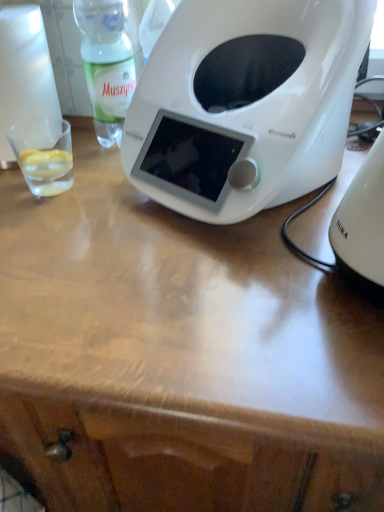
The width and height of the screenshot is (384, 512). In order to click on free space that is to the left of white plastic toaster at center in this screenshot , I will do `click(80, 218)`.